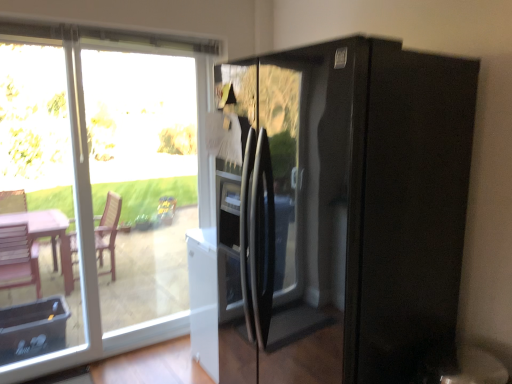
Question: Considering the relative sizes of transparent glass door at left, the second glass door in the right-to-left sequence, and transparent glass window at upper left in the image provided, is transparent glass door at left, the second glass door in the right-to-left sequence, shorter than transparent glass window at upper left?

Choices:
 (A) no
 (B) yes

Answer: (B)

Question: Is transparent glass door at left, the first glass door from the left, located outside transparent glass window at upper left?

Choices:
 (A) yes
 (B) no

Answer: (B)

Question: From a real-world perspective, is transparent glass door at left, the second glass door in the right-to-left sequence, positioned under transparent glass window at upper left based on gravity?

Choices:
 (A) yes
 (B) no

Answer: (B)

Question: Is transparent glass door at left, the first glass door from the left, far from transparent glass window at upper left?

Choices:
 (A) no
 (B) yes

Answer: (A)

Question: Is transparent glass door at left, the first glass door from the left, oriented away from transparent glass window at upper left?

Choices:
 (A) yes
 (B) no

Answer: (A)

Question: Is black glass refrigerator at right inside the boundaries of transparent glass window at upper left, or outside?

Choices:
 (A) inside
 (B) outside

Answer: (B)

Question: From a real-world perspective, is black glass refrigerator at right above or below transparent glass window at upper left?

Choices:
 (A) above
 (B) below

Answer: (B)

Question: Considering the positions of point (330, 367) and point (49, 296), is point (330, 367) closer or farther from the camera than point (49, 296)?

Choices:
 (A) closer
 (B) farther

Answer: (A)

Question: From the image's perspective, is black glass refrigerator at right located above or below transparent glass window at upper left?

Choices:
 (A) below
 (B) above

Answer: (A)

Question: In the image, is transparent glass door at left, which is the first glass door from right to left, positioned in front of or behind transparent glass window at upper left?

Choices:
 (A) behind
 (B) front

Answer: (A)

Question: Based on their positions, is transparent glass door at left, which is the first glass door from right to left, located to the left or right of transparent glass window at upper left?

Choices:
 (A) right
 (B) left

Answer: (A)

Question: In terms of height, does transparent glass door at left, which appears as the 2th glass door when viewed from the left, look taller or shorter compared to transparent glass window at upper left?

Choices:
 (A) tall
 (B) short

Answer: (B)

Question: Considering the positions of point (137, 110) and point (113, 221), is point (137, 110) closer or farther from the camera than point (113, 221)?

Choices:
 (A) farther
 (B) closer

Answer: (B)

Question: In terms of height, does transparent glass window at upper left look taller or shorter compared to transparent glass door at left, the second glass door in the right-to-left sequence?

Choices:
 (A) tall
 (B) short

Answer: (A)

Question: In terms of width, does transparent glass window at upper left look wider or thinner when compared to transparent glass door at left, the first glass door from the left?

Choices:
 (A) thin
 (B) wide

Answer: (B)